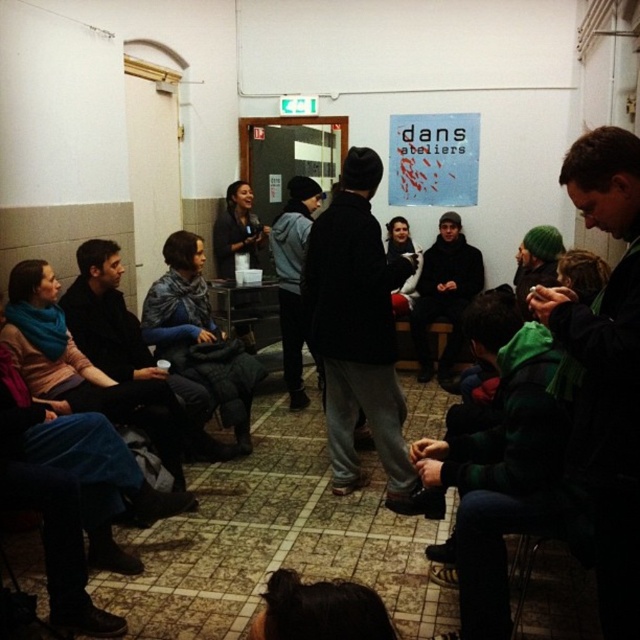
Who is positioned more to the right, dark blue sweater at center or black woolen sweater at center?

black woolen sweater at center is more to the right.

Looking at this image, between dark blue sweater at center and black woolen sweater at center, which one has less height?

dark blue sweater at center

Find the location of a particular element. dark blue sweater at center is located at coordinates (129, 342).

Does dark gray knit hat at center appear on the right side of dark blue sweater at center?

Yes, dark gray knit hat at center is to the right of dark blue sweater at center.

Is dark gray knit hat at center closer to camera compared to dark blue sweater at center?

That is True.

Is point (352, 396) less distant than point (106, 317)?

Yes, point (352, 396) is in front of point (106, 317).

Where is `dark gray knit hat at center`? The image size is (640, 640). dark gray knit hat at center is located at coordinates (358, 330).

In the scene shown: Can you confirm if dark gray knit hat at center is wider than black woolen sweater at center?

No.

Who is more forward, (x=353, y=189) or (x=445, y=321)?

Point (x=353, y=189) is in front.

At what (x,y) coordinates should I click in order to perform the action: click on dark gray knit hat at center. Please return your answer as a coordinate pair (x, y). Looking at the image, I should click on (358, 330).